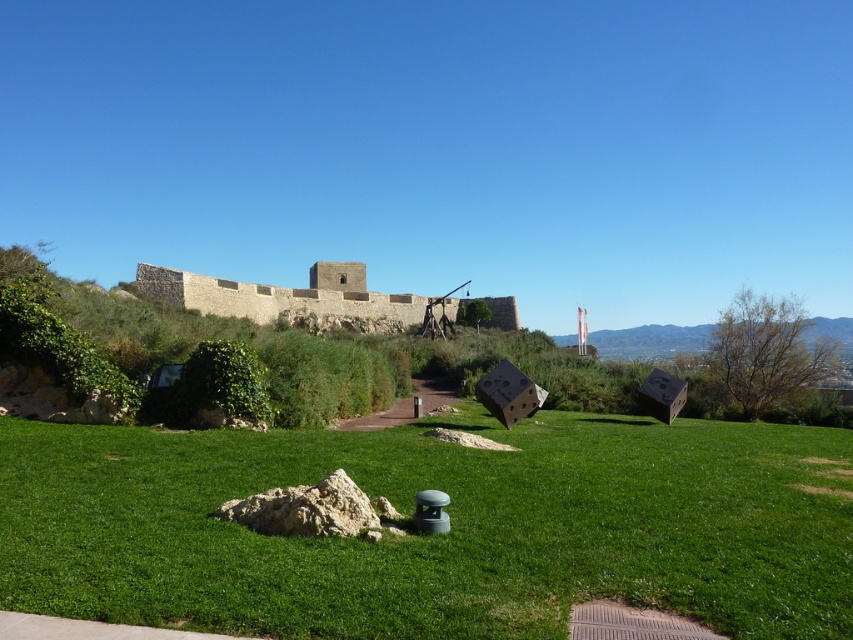
You are planning to set up a picnic blanket in the scene. Which area would be more suitable for placing the blanket, the green grass at center or the stone wall at center, considering their sizes?

The green grass at center has a smaller size compared to the stone wall at center, so the stone wall at center would provide a larger area for placing the picnic blanket.

You are standing at the point labeled as point [434,536] in the image. What is the immediate surface you are standing on?

The immediate surface you are standing on is the green grass at center, as the point [434,536] indicates this location.

You are planning to install a new garden feature between the green grass at center and the stone wall at center. Based on their positions, which object should you place your feature closer to in order to be between them?

The green grass at center is located below the stone wall at center, so to place the garden feature between them, you should position it closer to the green grass at center since it is beneath the stone wall at center.